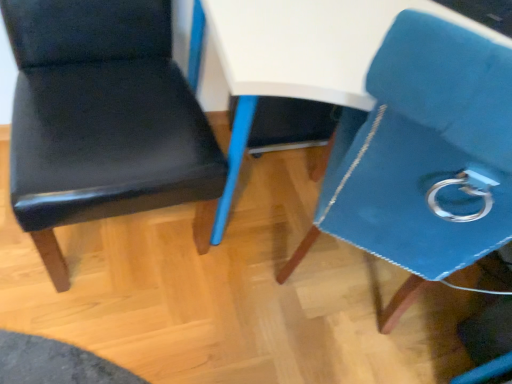
Question: From a real-world perspective, is blue leather chair at upper right, the first chair viewed from the right, located higher than matte black chair at left, arranged as the second chair when viewed from the right?

Choices:
 (A) yes
 (B) no

Answer: (A)

Question: Is blue leather chair at upper right, the 2th chair from the left, beside matte black chair at left, placed as the 1th chair when sorted from left to right?

Choices:
 (A) no
 (B) yes

Answer: (A)

Question: Is blue leather chair at upper right, the 2th chair from the left, surrounding matte black chair at left, arranged as the second chair when viewed from the right?

Choices:
 (A) yes
 (B) no

Answer: (B)

Question: Is blue leather chair at upper right, the 2th chair from the left, at the left side of matte black chair at left, arranged as the second chair when viewed from the right?

Choices:
 (A) no
 (B) yes

Answer: (A)

Question: From a real-world perspective, is blue leather chair at upper right, the 2th chair from the left, positioned under matte black chair at left, arranged as the second chair when viewed from the right, based on gravity?

Choices:
 (A) yes
 (B) no

Answer: (B)

Question: Could you tell me if blue leather chair at upper right, the first chair viewed from the right, is facing matte black chair at left, placed as the 1th chair when sorted from left to right?

Choices:
 (A) yes
 (B) no

Answer: (B)

Question: Is matte black chair at left, arranged as the second chair when viewed from the right, facing away from blue leather chair at upper right, the 2th chair from the left?

Choices:
 (A) yes
 (B) no

Answer: (B)

Question: From the image's perspective, is matte black chair at left, placed as the 1th chair when sorted from left to right, beneath blue leather chair at upper right, the 2th chair from the left?

Choices:
 (A) no
 (B) yes

Answer: (A)

Question: Does matte black chair at left, placed as the 1th chair when sorted from left to right, come behind blue leather chair at upper right, the first chair viewed from the right?

Choices:
 (A) no
 (B) yes

Answer: (B)

Question: Does matte black chair at left, arranged as the second chair when viewed from the right, appear on the left side of blue leather chair at upper right, the 2th chair from the left?

Choices:
 (A) yes
 (B) no

Answer: (A)

Question: From a real-world perspective, is matte black chair at left, arranged as the second chair when viewed from the right, below blue leather chair at upper right, the 2th chair from the left?

Choices:
 (A) no
 (B) yes

Answer: (B)

Question: Is matte black chair at left, arranged as the second chair when viewed from the right, bigger than blue leather chair at upper right, the 2th chair from the left?

Choices:
 (A) no
 (B) yes

Answer: (A)

Question: Is matte black chair at left, arranged as the second chair when viewed from the right, in front of or behind blue leather chair at upper right, the 2th chair from the left, in the image?

Choices:
 (A) behind
 (B) front

Answer: (A)